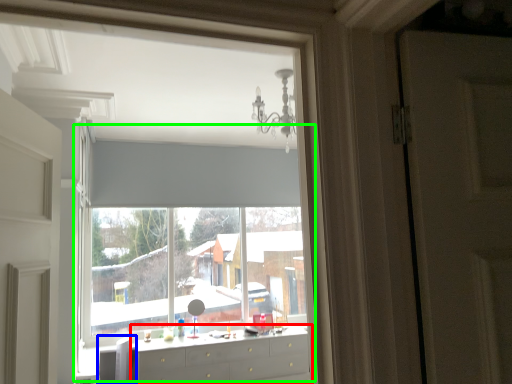
Question: Considering the real-world distances, which object is closest to chest of drawers (highlighted by a red box)? swivel chair (highlighted by a blue box) or bay window (highlighted by a green box).

Choices:
 (A) swivel chair
 (B) bay window

Answer: (A)